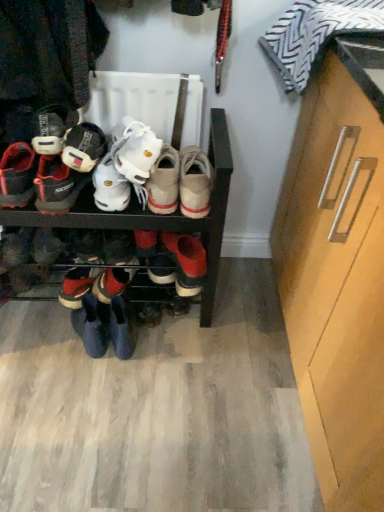
The image size is (384, 512). I want to click on free location in front of black matte shoe rack at center, so click(x=107, y=408).